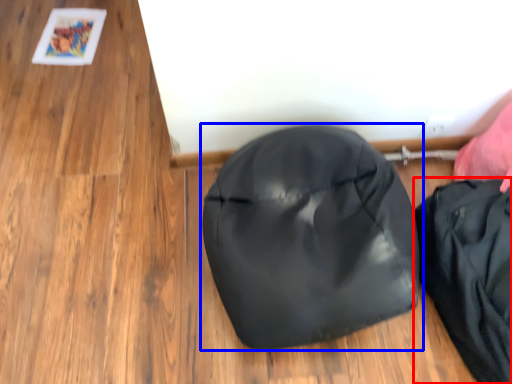
Question: Which of the following is the farthest to the observer, pouch (highlighted by a red box) or footwear (highlighted by a blue box)?

Choices:
 (A) pouch
 (B) footwear

Answer: (A)